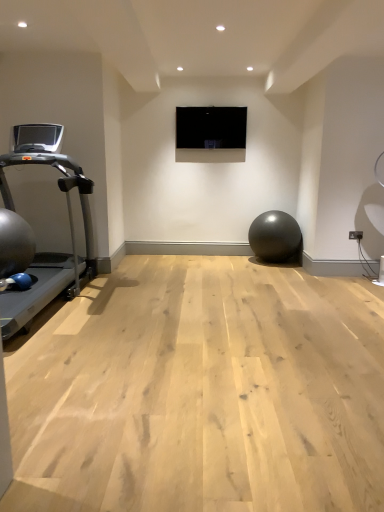
Question: From a real-world perspective, is black glossy screen at center above or below matte black ball at center?

Choices:
 (A) above
 (B) below

Answer: (A)

Question: Considering the positions of black glossy screen at center and matte black ball at center in the image, is black glossy screen at center taller or shorter than matte black ball at center?

Choices:
 (A) tall
 (B) short

Answer: (B)

Question: Which object is the farthest from the matte black ball at center?

Choices:
 (A) silver metallic treadmill at left
 (B) black glossy screen at center

Answer: (A)

Question: Which of these objects is positioned closest to the black glossy screen at center?

Choices:
 (A) matte black ball at center
 (B) silver metallic treadmill at left

Answer: (A)